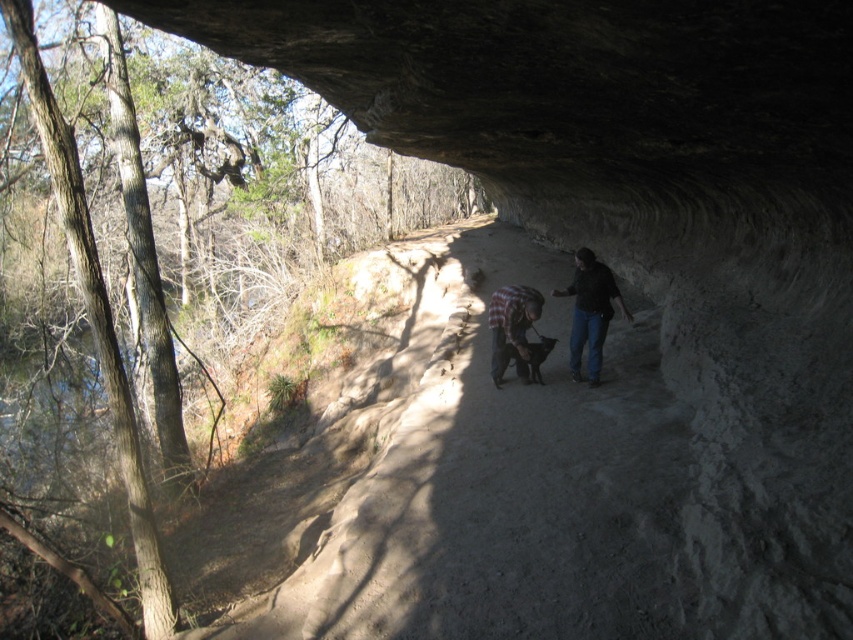
Is dark blue jeans at center bigger than plaid shirt at center?

Indeed, dark blue jeans at center has a larger size compared to plaid shirt at center.

Describe the element at coordinates (590, 310) in the screenshot. Image resolution: width=853 pixels, height=640 pixels. I see `dark blue jeans at center` at that location.

The image size is (853, 640). I want to click on dark blue jeans at center, so click(x=590, y=310).

Where is `dark blue jeans at center`? dark blue jeans at center is located at coordinates (590, 310).

The image size is (853, 640). Describe the element at coordinates (512, 328) in the screenshot. I see `plaid shirt at center` at that location.

Between point (523, 374) and point (502, 365), which one is positioned behind?

Positioned behind is point (523, 374).

At what (x,y) coordinates should I click in order to perform the action: click on plaid shirt at center. Please return your answer as a coordinate pair (x, y). The height and width of the screenshot is (640, 853). Looking at the image, I should click on (512, 328).

Does dark blue jeans at center have a lesser width compared to black fur dog at center?

No, dark blue jeans at center is not thinner than black fur dog at center.

Is dark blue jeans at center smaller than black fur dog at center?

Actually, dark blue jeans at center might be larger than black fur dog at center.

Measure the distance between point (578, 300) and camera.

A distance of 8.24 meters exists between point (578, 300) and camera.

Find the location of `dark blue jeans at center`. dark blue jeans at center is located at coordinates (590, 310).